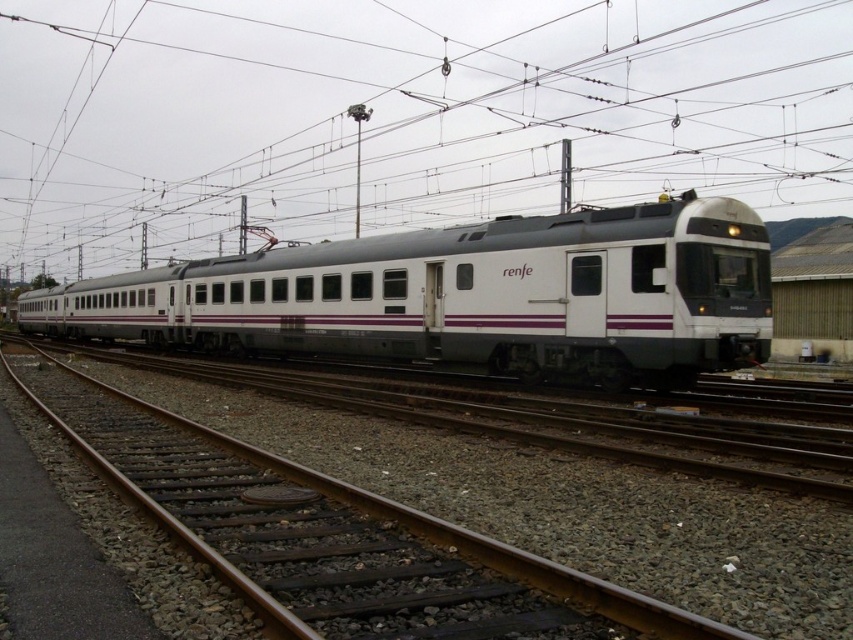
Does point (567, 36) come farther from viewer compared to point (585, 211)?

Yes.

Can you confirm if metallic wire at upper center is thinner than white matte train at center?

No, metallic wire at upper center is not thinner than white matte train at center.

Does point (396, 202) lie in front of point (405, 321)?

No, (396, 202) is further to viewer.

Where is `metallic wire at upper center`? The width and height of the screenshot is (853, 640). metallic wire at upper center is located at coordinates (399, 115).

Does point (525, 285) come in front of point (645, 605)?

That is False.

What do you see at coordinates (467, 296) in the screenshot? I see `white matte train at center` at bounding box center [467, 296].

Where is `white matte train at center`? white matte train at center is located at coordinates (467, 296).

Which is more to the left, white matte train at center or metallic gray train at center?

white matte train at center is more to the left.

Which is above, white matte train at center or metallic gray train at center?

metallic gray train at center is above.

The height and width of the screenshot is (640, 853). What do you see at coordinates (467, 296) in the screenshot?
I see `white matte train at center` at bounding box center [467, 296].

This screenshot has height=640, width=853. I want to click on white matte train at center, so click(x=467, y=296).